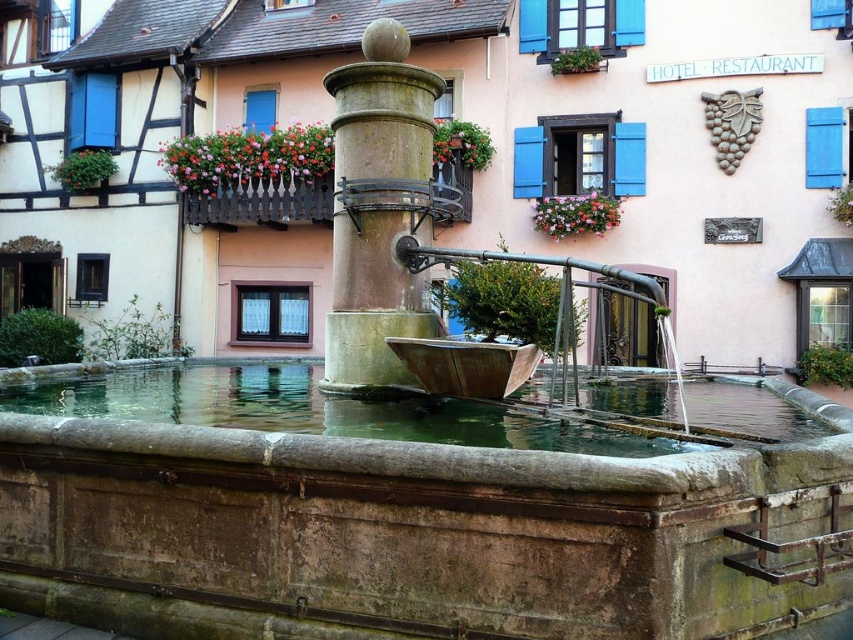
You are standing in front of the quaint building and see the brown stone water at center and the greenish stone fountain at center. Which object is positioned more to the right side?

The brown stone water at center is positioned more to the right side than the greenish stone fountain at center.

You are standing in front of the fountain and notice two sections of water in the basin. Which section of water, the brown stone water at center or the green stone water at center, is located to the right side?

The brown stone water at center is positioned on the right side of green stone water at center.

You are standing in front of the fountain and want to take a photo. You notice two points marked in the scene. Which point, point [210,396] or point [397,170], is closer to your camera lens?

Point [210,396] is closer to the camera lens than point [397,170].